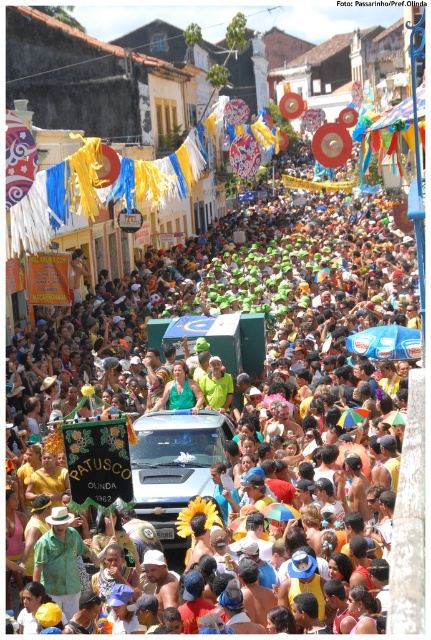
Question: Is multicolored fabric crowd at center bigger than green matte shirt at center?

Choices:
 (A) no
 (B) yes

Answer: (B)

Question: Can you confirm if multicolored fabric crowd at center is positioned to the right of green matte shirt at center?

Choices:
 (A) yes
 (B) no

Answer: (A)

Question: Among these points, which one is nearest to the camera?

Choices:
 (A) (178, 444)
 (B) (156, 404)

Answer: (A)

Question: Is multicolored fabric crowd at center closer to the viewer compared to green matte shirt at center?

Choices:
 (A) yes
 (B) no

Answer: (A)

Question: Which object appears farthest from the camera in this image?

Choices:
 (A) green matte shirt at center
 (B) multicolored fabric crowd at center

Answer: (A)